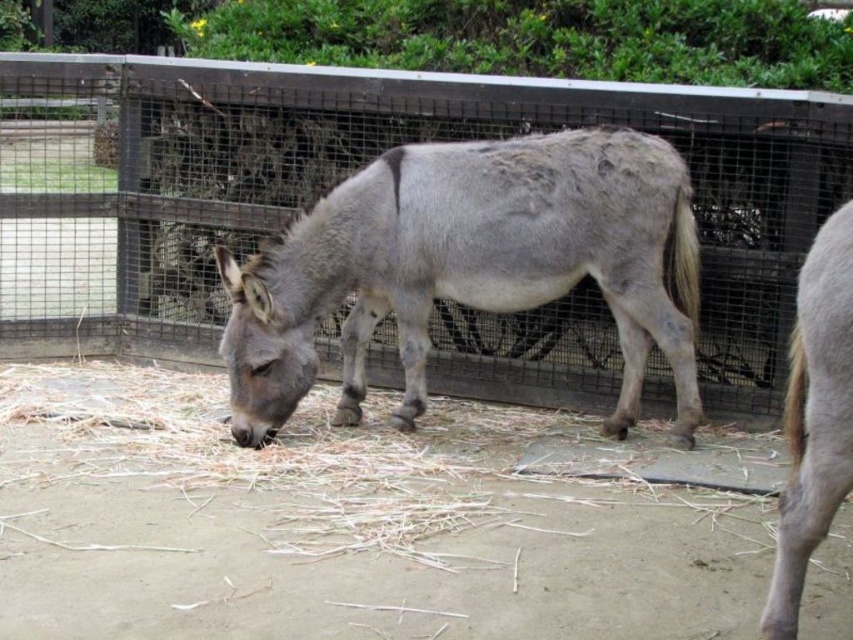
Does wooden fence at center have a lesser width compared to gray matte donkey at center?

Correct, wooden fence at center's width is less than gray matte donkey at center's.

Which is behind, point (761, 257) or point (660, 342)?

The point (761, 257) is more distant.

This screenshot has height=640, width=853. I want to click on wooden fence at center, so click(x=376, y=154).

Can you confirm if wooden fence at center is positioned below gray matte horse at right?

No, wooden fence at center is not below gray matte horse at right.

In order to click on wooden fence at center in this screenshot , I will do `click(376, 154)`.

The height and width of the screenshot is (640, 853). I want to click on wooden fence at center, so click(x=376, y=154).

Looking at this image, is gray matte donkey at center smaller than gray matte horse at right?

No, gray matte donkey at center is not smaller than gray matte horse at right.

Who is lower down, gray matte donkey at center or gray matte horse at right?

Positioned lower is gray matte horse at right.

The image size is (853, 640). I want to click on gray matte donkey at center, so click(469, 266).